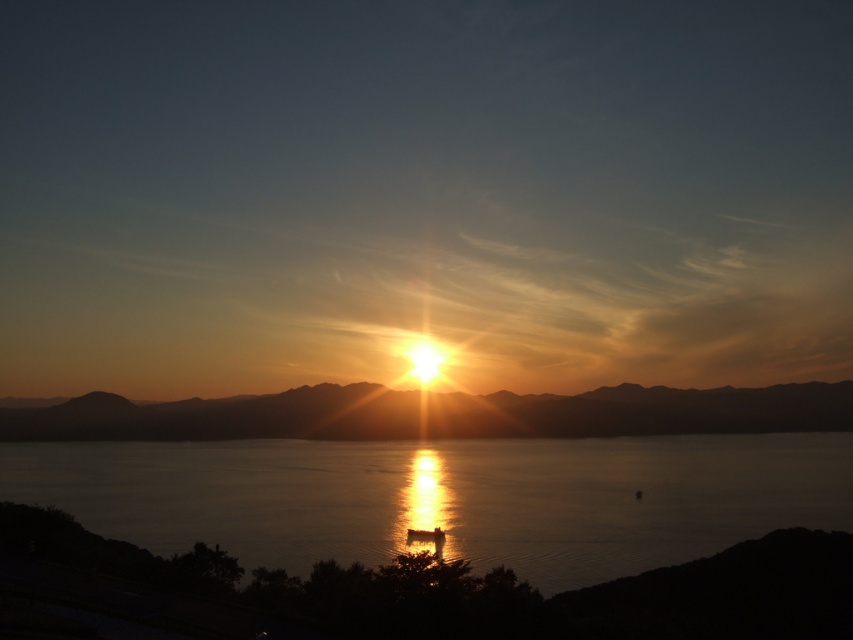
Question: Does glistening reflective water at center lie in front of golden reflective water at center?

Choices:
 (A) no
 (B) yes

Answer: (B)

Question: Is glistening reflective water at center positioned before golden reflective water at center?

Choices:
 (A) yes
 (B) no

Answer: (A)

Question: Which point is farther to the camera?

Choices:
 (A) (314, 435)
 (B) (543, 444)

Answer: (A)

Question: Is glistening reflective water at center behind golden reflective water at center?

Choices:
 (A) yes
 (B) no

Answer: (B)

Question: Which point is farther to the camera?

Choices:
 (A) golden reflective water at center
 (B) glistening reflective water at center

Answer: (A)